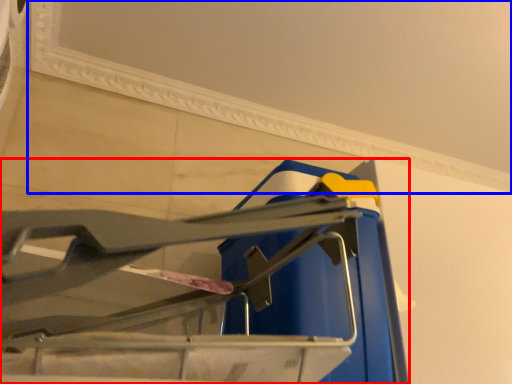
Question: Which of the following is the closest to the observer, furniture (highlighted by a red box) or window frame (highlighted by a blue box)?

Choices:
 (A) furniture
 (B) window frame

Answer: (A)